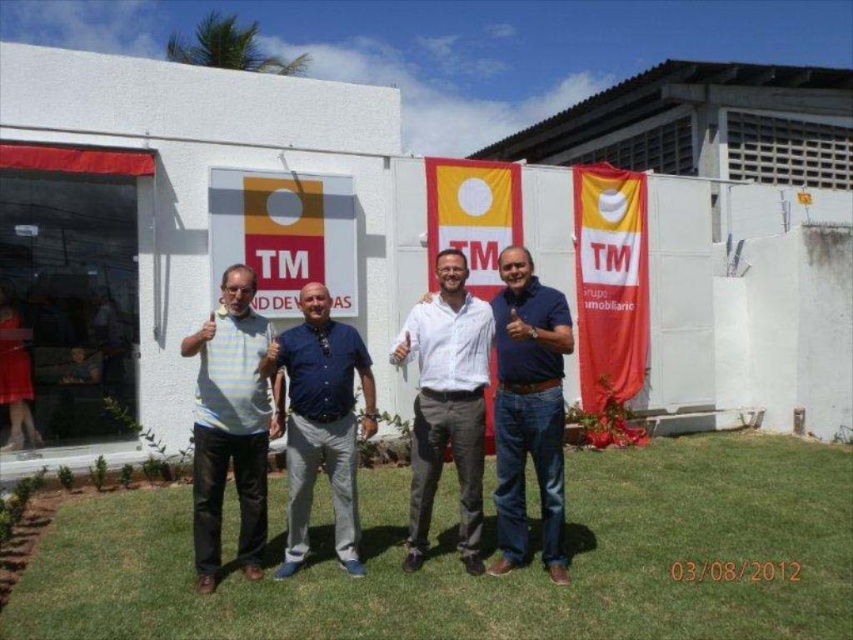
Question: Which point appears farthest from the camera in this image?

Choices:
 (A) (x=309, y=481)
 (B) (x=543, y=474)
 (C) (x=747, y=458)
 (D) (x=268, y=404)

Answer: (C)

Question: Considering the relative positions of striped cotton shirt at center and white shirt at center in the image provided, where is striped cotton shirt at center located with respect to white shirt at center?

Choices:
 (A) above
 (B) below

Answer: (B)

Question: Can you confirm if striped cotton shirt at center is positioned above white shirt at center?

Choices:
 (A) no
 (B) yes

Answer: (A)

Question: Which object is positioned closest to the white cotton shirt at center?

Choices:
 (A) blue denim jeans at center
 (B) green grass at lower center
 (C) striped cotton shirt at center
 (D) white shirt at center

Answer: (D)

Question: Which point is closer to the camera?

Choices:
 (A) (547, 314)
 (B) (451, 305)
 (C) (403, 611)

Answer: (C)

Question: Can you confirm if green grass at lower center is positioned to the right of blue denim jeans at center?

Choices:
 (A) yes
 (B) no

Answer: (A)